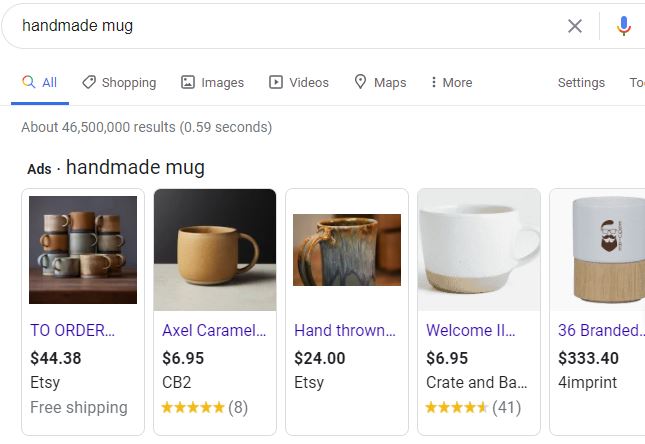
The image size is (645, 444). I want to click on solid brown mug, so click(x=51, y=238), click(x=95, y=266), click(x=115, y=262), click(x=106, y=221), click(x=83, y=216).